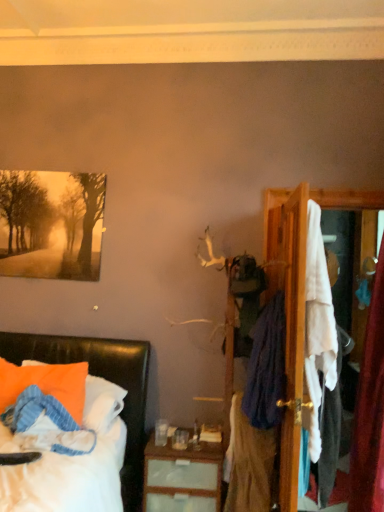
Locate an element on the screen. blank space situated above wooden dresser at right (from a real-world perspective) is located at coordinates (342, 186).